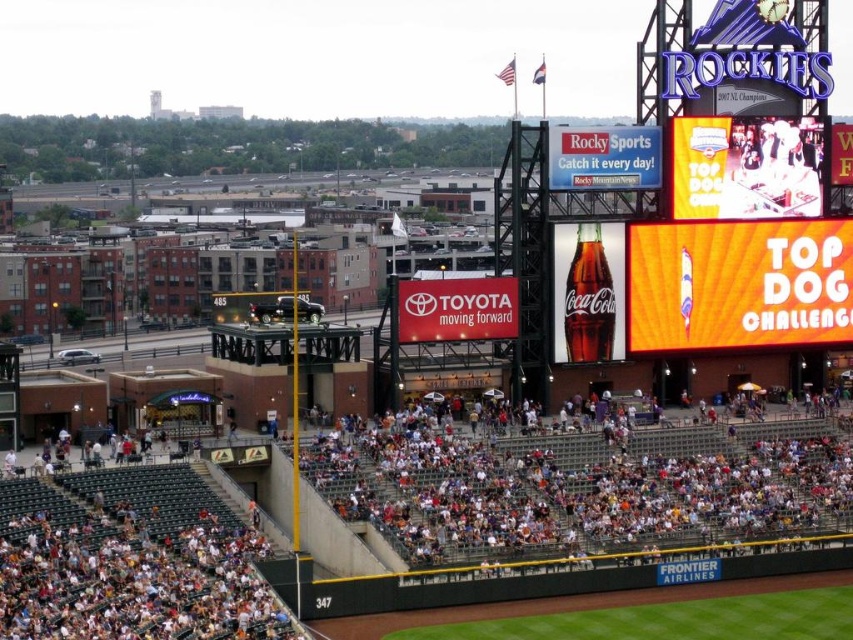
You are a spectator at the baseball stadium and want to move from your current position to the yellow fabric scoreboard at upper right. The path is clear, but you have a 1.5 meter long banner to carry. Can you walk straight to the scoreboard without the banner touching the white plastic seats at lower center?

The distance between the white plastic seats at lower center and the yellow fabric scoreboard at upper right is 14.97 meters. Since the banner is only 1.5 meters long, you can walk straight to the scoreboard without the banner touching the seats.